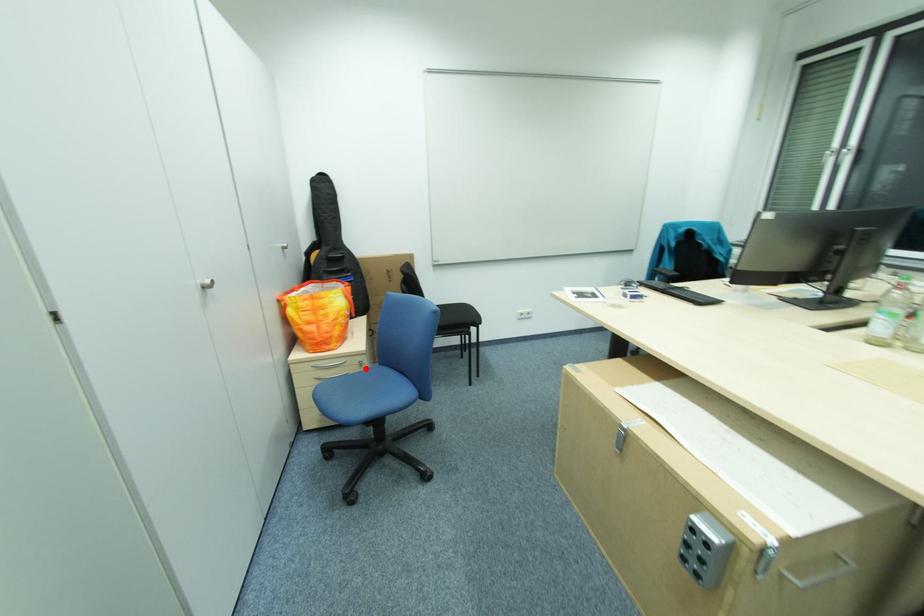
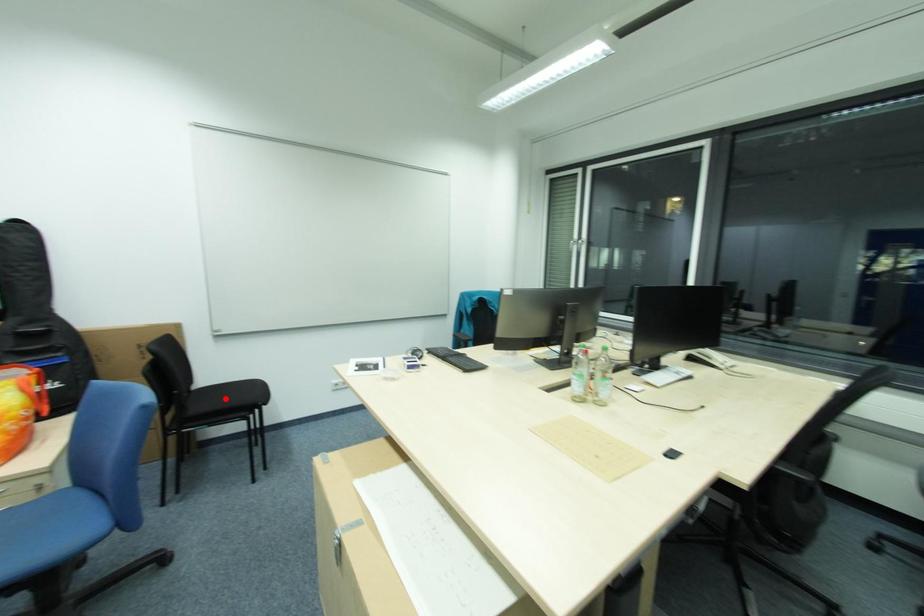
I am providing you with two images of the same scene from different viewpoints. A red point is marked on the first image and another point is marked on the second image. Is the marked point in image1 the same physical position as the marked point in image2?

No